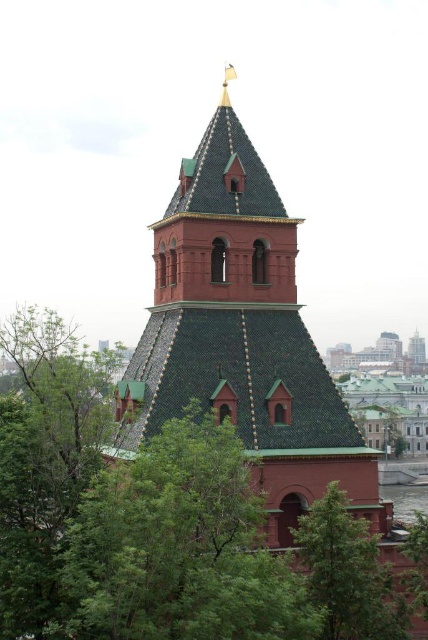
Is point (160, 465) closer to viewer compared to point (207, 381)?

That is True.

Is green textured leaves at center taller than green tiled tower at center?

In fact, green textured leaves at center may be shorter than green tiled tower at center.

Identify the location of green textured leaves at center. (151, 522).